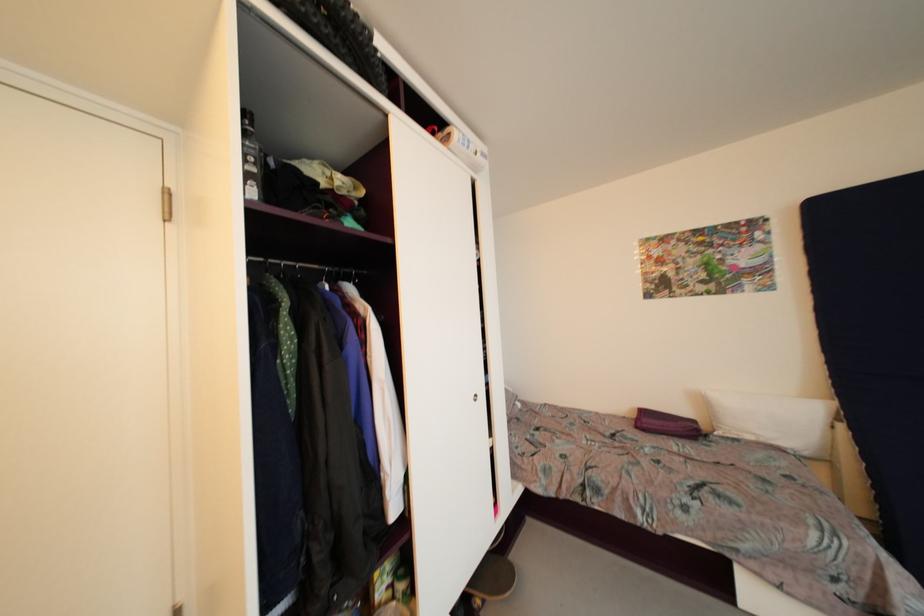
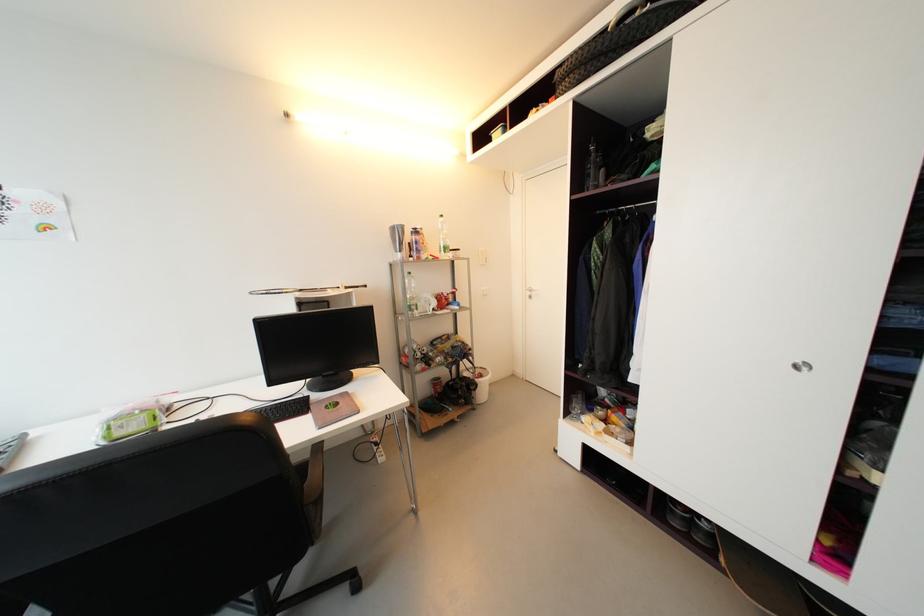
In the second image, find the point that corresponds to pixel 480 397 in the first image.

(810, 366)